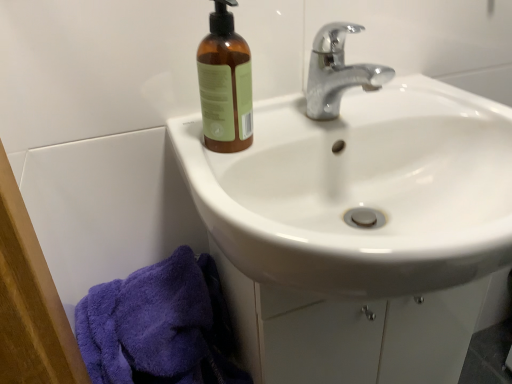
Question: Looking at the image, does white glossy sink at upper center seem bigger or smaller compared to brown glass bottle at upper left?

Choices:
 (A) big
 (B) small

Answer: (A)

Question: From the image's perspective, relative to brown glass bottle at upper left, is white glossy sink at upper center above or below?

Choices:
 (A) below
 (B) above

Answer: (A)

Question: Estimate the real-world distances between objects in this image. Which object is closer to the white glossy sink at upper center?

Choices:
 (A) purple fluffy towel at lower left
 (B) brown glass bottle at upper left
 (C) chrome metallic faucet at upper center

Answer: (C)

Question: Estimate the real-world distances between objects in this image. Which object is farther from the brown glass bottle at upper left?

Choices:
 (A) chrome metallic faucet at upper center
 (B) white glossy sink at upper center
 (C) purple fluffy towel at lower left

Answer: (C)